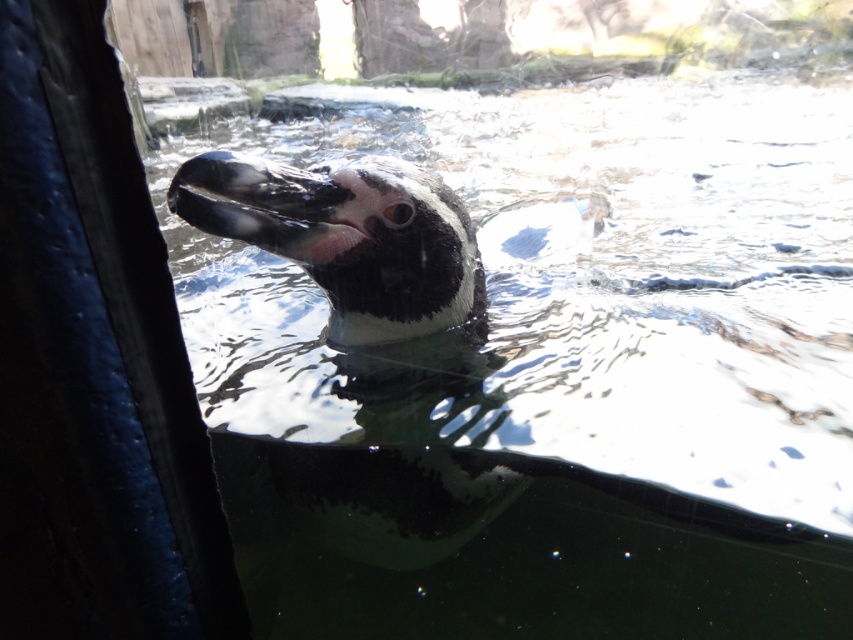
Question: Does clear water at center appear under black matte penguin at center?

Choices:
 (A) no
 (B) yes

Answer: (A)

Question: Among these points, which one is nearest to the camera?

Choices:
 (A) (292, 216)
 (B) (343, 570)

Answer: (A)

Question: In this image, where is clear water at center located relative to black matte penguin at center?

Choices:
 (A) left
 (B) right

Answer: (B)

Question: Which point appears closest to the camera in this image?

Choices:
 (A) [x=508, y=609]
 (B) [x=347, y=252]

Answer: (B)

Question: Among these points, which one is farthest from the camera?

Choices:
 (A) (401, 173)
 (B) (735, 593)

Answer: (B)

Question: Is clear water at center above black matte penguin at center?

Choices:
 (A) no
 (B) yes

Answer: (B)